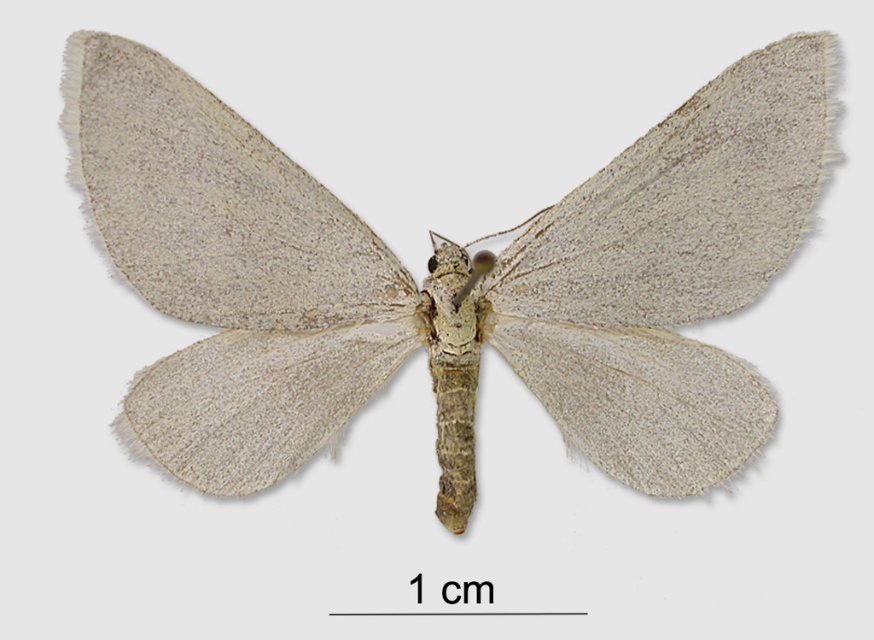
Does fuzzy gray wing at upper left have a greater width compared to fuzzy white wing at center?

Correct, the width of fuzzy gray wing at upper left exceeds that of fuzzy white wing at center.

Is fuzzy gray wing at upper left to the left of fuzzy white wing at center from the viewer's perspective?

Yes, fuzzy gray wing at upper left is to the left of fuzzy white wing at center.

Is point (296, 289) positioned before point (680, 237)?

No.

At what (x,y) coordinates should I click in order to perform the action: click on fuzzy gray wing at upper left. Please return your answer as a coordinate pair (x, y). This screenshot has height=640, width=874. Looking at the image, I should click on (212, 204).

Can you confirm if fuzzy beige moth at center is positioned to the right of fuzzy white wing at center?

Incorrect, fuzzy beige moth at center is not on the right side of fuzzy white wing at center.

Does fuzzy beige moth at center appear under fuzzy white wing at center?

Indeed, fuzzy beige moth at center is positioned under fuzzy white wing at center.

The image size is (874, 640). Describe the element at coordinates (448, 280) in the screenshot. I see `fuzzy beige moth at center` at that location.

Locate an element on the screen. fuzzy beige moth at center is located at coordinates (448, 280).

Does fuzzy beige moth at center have a smaller size compared to fuzzy gray wing at upper left?

No.

Can you confirm if fuzzy beige moth at center is shorter than fuzzy gray wing at upper left?

Incorrect, fuzzy beige moth at center's height does not fall short of fuzzy gray wing at upper left's.

Who is more forward, (227,305) or (262,248)?

Point (262,248) is more forward.

Find the location of a particular element. Image resolution: width=874 pixels, height=640 pixels. fuzzy beige moth at center is located at coordinates click(448, 280).